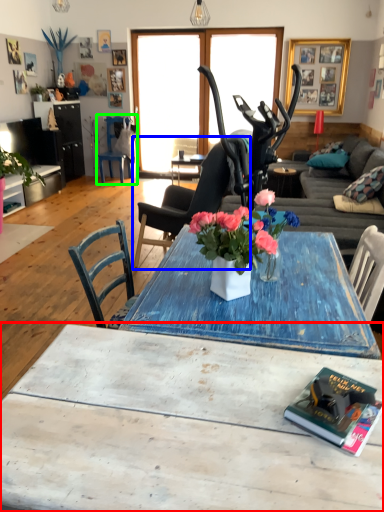
Question: Based on their relative distances, which object is nearer to coffee table (highlighted by a red box)? Choose from chair (highlighted by a blue box) and chair (highlighted by a green box).

Choices:
 (A) chair
 (B) chair

Answer: (A)